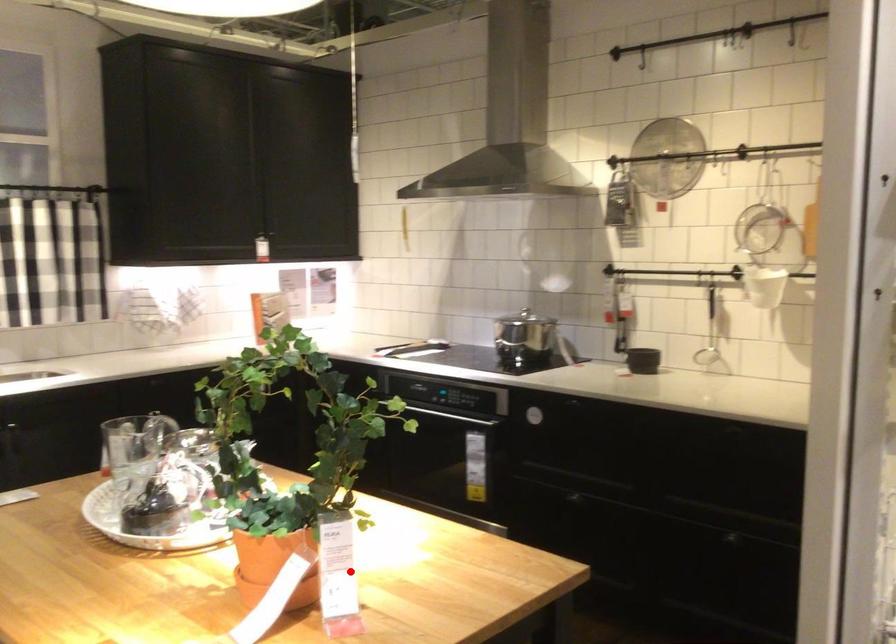
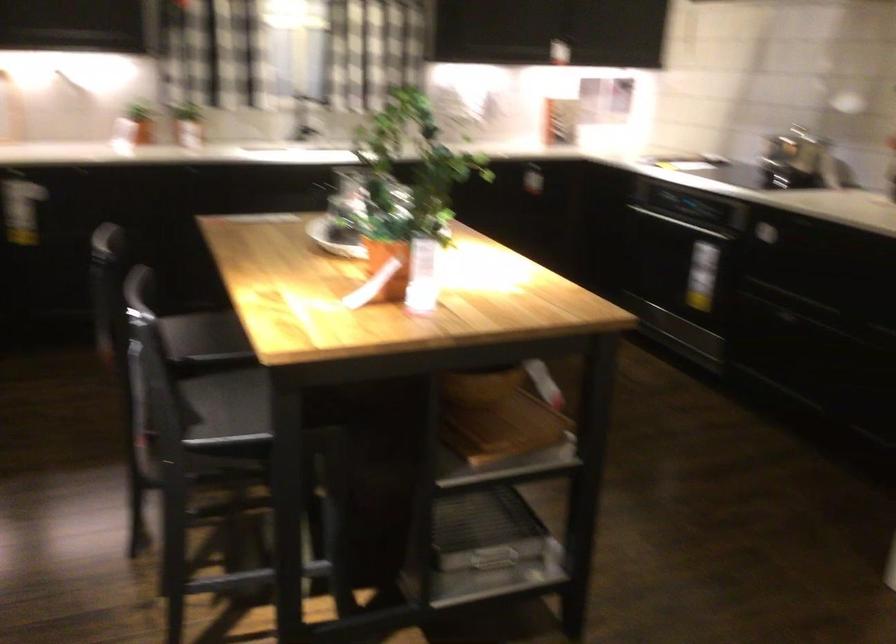
Question: I am providing you with two images of the same scene from different viewpoints. Image1 has a red point marked. In image2, the corresponding 3D location appears at what relative position? Reply with the corresponding letter.

Choices:
 (A) Closer
 (B) Farther

Answer: (B)